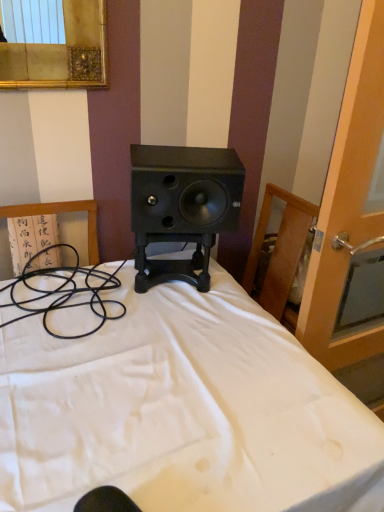
At what (x,y) coordinates should I click in order to perform the action: click on white matte bed at center. Please return your answer as a coordinate pair (x, y). The width and height of the screenshot is (384, 512). Looking at the image, I should click on (182, 411).

Measure the distance between black matte speaker at center and camera.

black matte speaker at center and camera are 3.80 feet apart from each other.

The image size is (384, 512). I want to click on white matte bed at center, so click(182, 411).

Is transparent glass screen door at right turned away from white matte bed at center?

No, transparent glass screen door at right is not facing away from white matte bed at center.

From a real-world perspective, between transparent glass screen door at right and white matte bed at center, who is vertically lower?

white matte bed at center, from a real-world perspective.

Is transparent glass screen door at right not close to white matte bed at center?

transparent glass screen door at right is near white matte bed at center, not far away.

How far apart are transparent glass screen door at right and white matte bed at center?

A distance of 18.88 inches exists between transparent glass screen door at right and white matte bed at center.

Is point (166, 304) closer or farther from the camera than point (330, 194)?

Point (166, 304) is farther from the camera than point (330, 194).

Between white matte bed at center and transparent glass screen door at right, which one has more height?

Standing taller between the two is transparent glass screen door at right.

From the picture: Measure the distance from white matte bed at center to transparent glass screen door at right.

18.88 inches.

Locate an element on the screen. The width and height of the screenshot is (384, 512). screen door above the white matte bed at center (from the image's perspective) is located at coordinates pos(348,205).

From the image's perspective, is white matte bed at center located above or below black matte speaker at center?

Based on their image positions, white matte bed at center is located beneath black matte speaker at center.

Is white matte bed at center far away from black matte speaker at center?

Actually, white matte bed at center and black matte speaker at center are a little close together.

How different are the orientations of white matte bed at center and black matte speaker at center in degrees?

The angular difference between white matte bed at center and black matte speaker at center is 19.3 degrees.

Considering the relative sizes of white matte bed at center and black matte speaker at center in the image provided, is white matte bed at center bigger than black matte speaker at center?

Yes.

From a real-world perspective, is black matte speaker at center above or below white matte bed at center?

Clearly, from a real-world perspective, black matte speaker at center is above white matte bed at center.

Does point (207, 172) come in front of point (234, 480)?

No, it is not.

Are black matte speaker at center and white matte bed at center located far from each other?

No.

Can you confirm if black matte speaker at center is shorter than white matte bed at center?

Indeed, black matte speaker at center has a lesser height compared to white matte bed at center.

Considering the sizes of transparent glass screen door at right and black matte speaker at center in the image, is transparent glass screen door at right wider or thinner than black matte speaker at center?

Considering their sizes, transparent glass screen door at right looks slimmer than black matte speaker at center.

From the image's perspective, between transparent glass screen door at right and black matte speaker at center, which one is located above?

black matte speaker at center, from the image's perspective.

Is black matte speaker at center completely or partially inside transparent glass screen door at right?

No, transparent glass screen door at right does not contain black matte speaker at center.

Is transparent glass screen door at right to the left of black matte speaker at center from the viewer's perspective?

No, transparent glass screen door at right is not to the left of black matte speaker at center.

Which object is wider, black matte speaker at center or transparent glass screen door at right?

black matte speaker at center.

Is black matte speaker at center looking in the opposite direction of transparent glass screen door at right?

No, transparent glass screen door at right is not at the back of black matte speaker at center.

Measure the distance between black matte speaker at center and transparent glass screen door at right.

black matte speaker at center is 15.47 inches away from transparent glass screen door at right.

You are a GUI agent. You are given a task and a screenshot of the screen. Output one action in this format:
    pyautogui.click(x=<x>, y=<y>)
    Task: Click on the bed in front of the transparent glass screen door at right
    
    Given the screenshot: What is the action you would take?
    pyautogui.click(x=182, y=411)

Where is `screen door on the right of the white matte bed at center`? Image resolution: width=384 pixels, height=512 pixels. screen door on the right of the white matte bed at center is located at coordinates (348, 205).

From the image, which object appears to be nearer to white matte bed at center, black matte speaker at center or transparent glass screen door at right?

The object closer to white matte bed at center is black matte speaker at center.

Looking at the image, which one is located further to transparent glass screen door at right, white matte bed at center or black matte speaker at center?

The object further to transparent glass screen door at right is white matte bed at center.

Looking at the image, which one is located closer to white matte bed at center, transparent glass screen door at right or black matte speaker at center?

black matte speaker at center is positioned closer to the anchor white matte bed at center.

Which object lies further to the anchor point black matte speaker at center, white matte bed at center or transparent glass screen door at right?

The object further to black matte speaker at center is white matte bed at center.

Based on the photo, looking at the image, which one is located further to black matte speaker at center, transparent glass screen door at right or white matte bed at center?

white matte bed at center.

Which object lies further to the anchor point transparent glass screen door at right, black matte speaker at center or white matte bed at center?

white matte bed at center is positioned further to the anchor transparent glass screen door at right.

At what (x,y) coordinates should I click in order to perform the action: click on speaker located between white matte bed at center and transparent glass screen door at right in the left-right direction. Please return your answer as a coordinate pair (x, y). The height and width of the screenshot is (512, 384). Looking at the image, I should click on (185, 189).